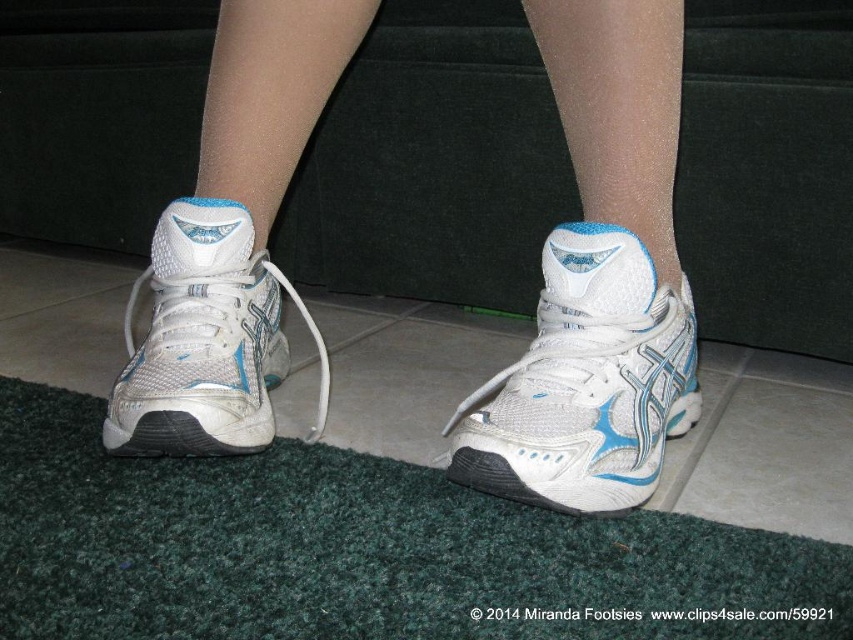
Question: Can you confirm if white mesh sneakers at center is wider than white mesh shoe at center?

Choices:
 (A) no
 (B) yes

Answer: (B)

Question: Which object appears closest to the camera in this image?

Choices:
 (A) white mesh shoe at center
 (B) white mesh shoe at lower left
 (C) white mesh sneakers at center

Answer: (A)

Question: Estimate the real-world distances between objects in this image. Which object is closer to the white mesh sneakers at center?

Choices:
 (A) white mesh shoe at lower left
 (B) white mesh shoe at center

Answer: (B)

Question: Does white mesh shoe at center appear under white mesh shoe at lower left?

Choices:
 (A) yes
 (B) no

Answer: (A)

Question: Which of the following is the closest to the observer?

Choices:
 (A) white mesh shoe at center
 (B) white mesh shoe at lower left
 (C) white mesh sneakers at center

Answer: (A)

Question: In this image, where is white mesh sneakers at center located relative to white mesh shoe at lower left?

Choices:
 (A) right
 (B) left

Answer: (A)